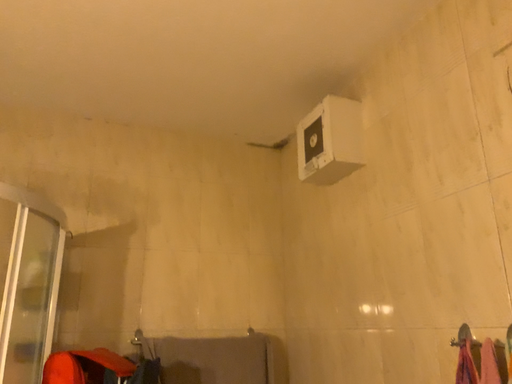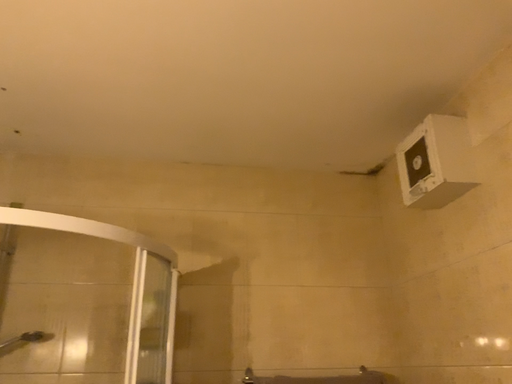
Question: Which way did the camera rotate in the video?

Choices:
 (A) rotated right
 (B) rotated left

Answer: (B)